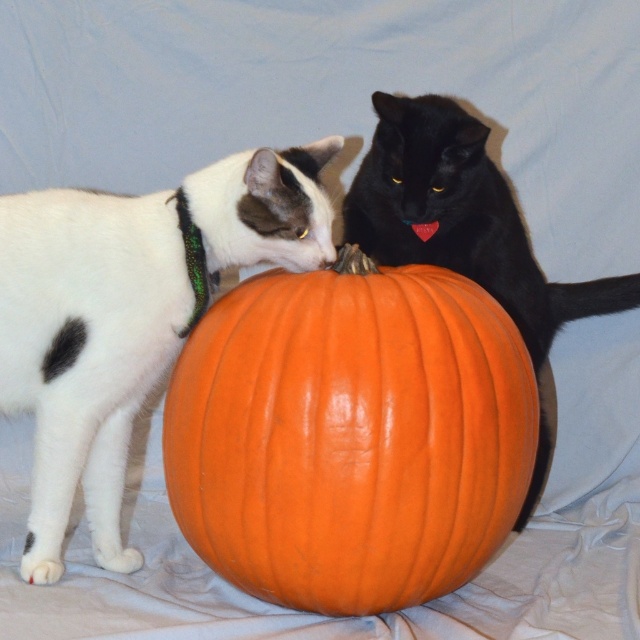
Question: Can you confirm if orange matte pumpkin at center is thinner than white matte fur cat at left?

Choices:
 (A) yes
 (B) no

Answer: (B)

Question: Which of these objects is positioned farthest from the orange matte pumpkin at center?

Choices:
 (A) white matte fur cat at left
 (B) black glossy cat at center

Answer: (B)

Question: Which point is farther from the camera taking this photo?

Choices:
 (A) (184, 305)
 (B) (376, 179)

Answer: (B)

Question: Is orange matte pumpkin at center thinner than black glossy cat at center?

Choices:
 (A) yes
 (B) no

Answer: (A)

Question: Which object is the closest to the orange matte pumpkin at center?

Choices:
 (A) white matte fur cat at left
 (B) black glossy cat at center

Answer: (A)

Question: Does orange matte pumpkin at center have a lesser width compared to black glossy cat at center?

Choices:
 (A) no
 (B) yes

Answer: (B)